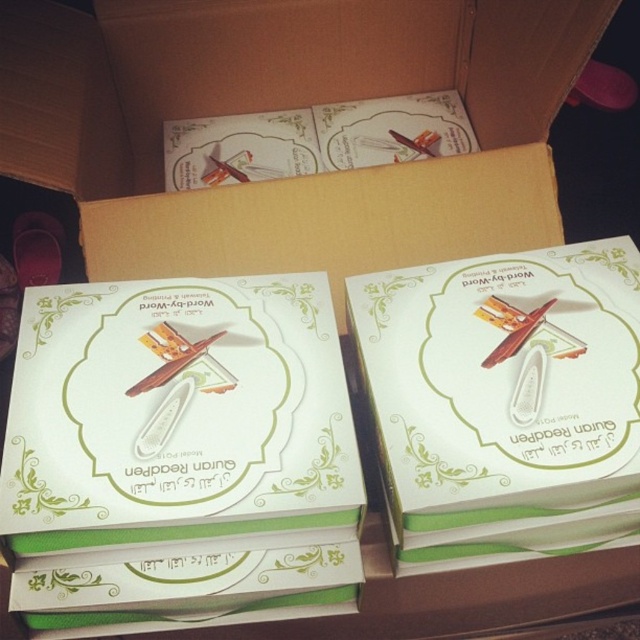
Question: Can you confirm if white paperboard box at center is positioned above white matte eraser at center?

Choices:
 (A) no
 (B) yes

Answer: (A)

Question: Among these points, which one is nearest to the camera?

Choices:
 (A) (248, 401)
 (B) (428, 525)

Answer: (B)

Question: Which object is farther from the camera taking this photo?

Choices:
 (A) white paperboard box at center
 (B) white matte eraser at center

Answer: (B)

Question: Is white paperboard box at center in front of white matte eraser at center?

Choices:
 (A) yes
 (B) no

Answer: (A)

Question: Does white paperboard box at center have a greater width compared to white matte eraser at center?

Choices:
 (A) no
 (B) yes

Answer: (B)

Question: Among these objects, which one is nearest to the camera?

Choices:
 (A) white paperboard box at center
 (B) white matte eraser at center

Answer: (A)